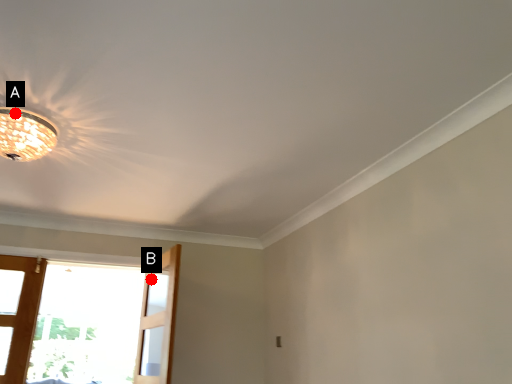
Question: Two points are circled on the image, labeled by A and B beside each circle. Which of the following is the closest to the observer?

Choices:
 (A) A is closer
 (B) B is closer

Answer: (A)